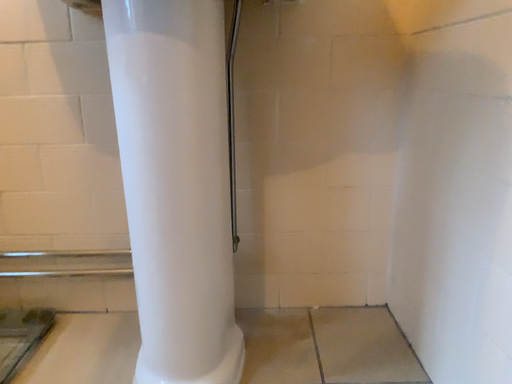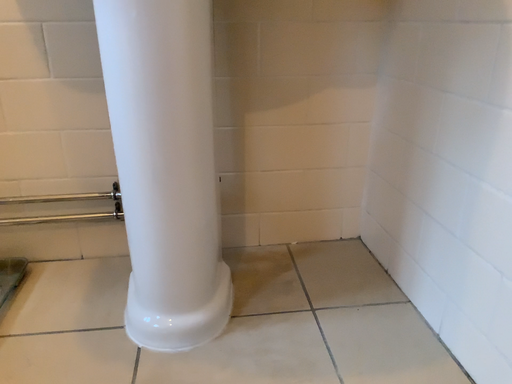
Question: How did the camera likely rotate when shooting the video?

Choices:
 (A) rotated left
 (B) rotated right

Answer: (B)